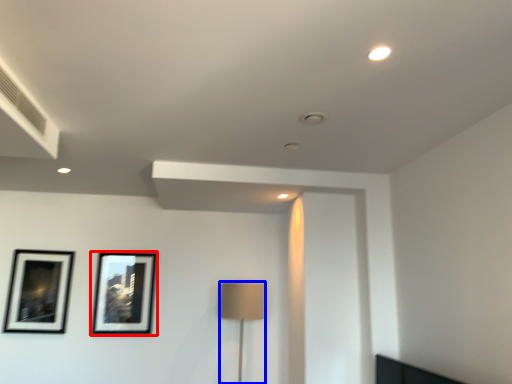
Question: Which point is closer to the camera, picture frame (highlighted by a red box) or table lamp (highlighted by a blue box)?

Choices:
 (A) picture frame
 (B) table lamp

Answer: (B)